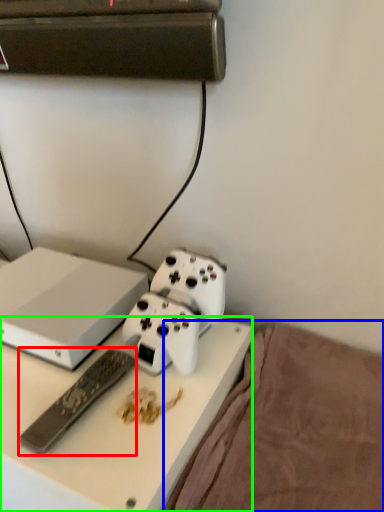
Question: Which object is the farthest from remote control (highlighted by a red box)? Choose among these: bedding (highlighted by a blue box) or desk (highlighted by a green box).

Choices:
 (A) bedding
 (B) desk

Answer: (A)